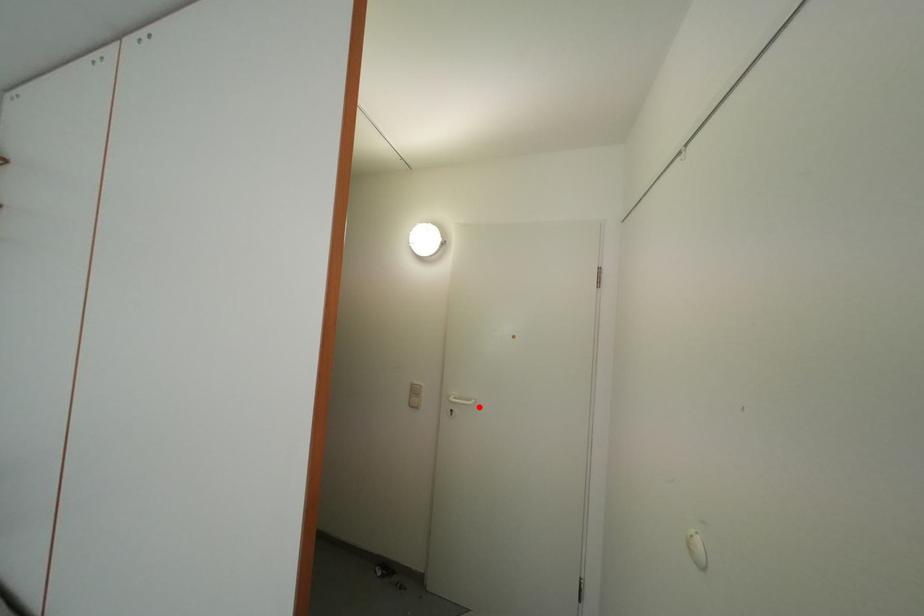
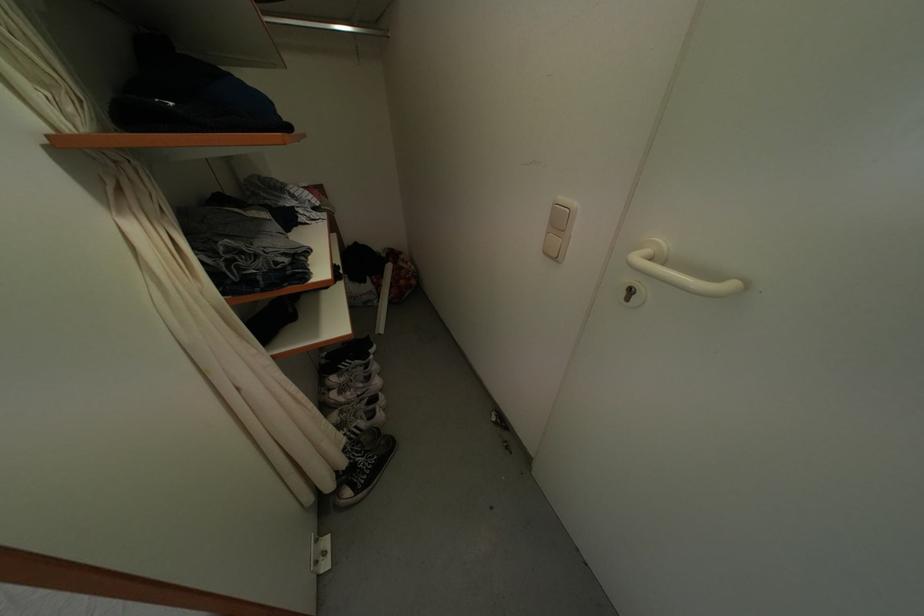
Where in the second image is the point corresponding to the highlighted location from the first image?

(739, 291)